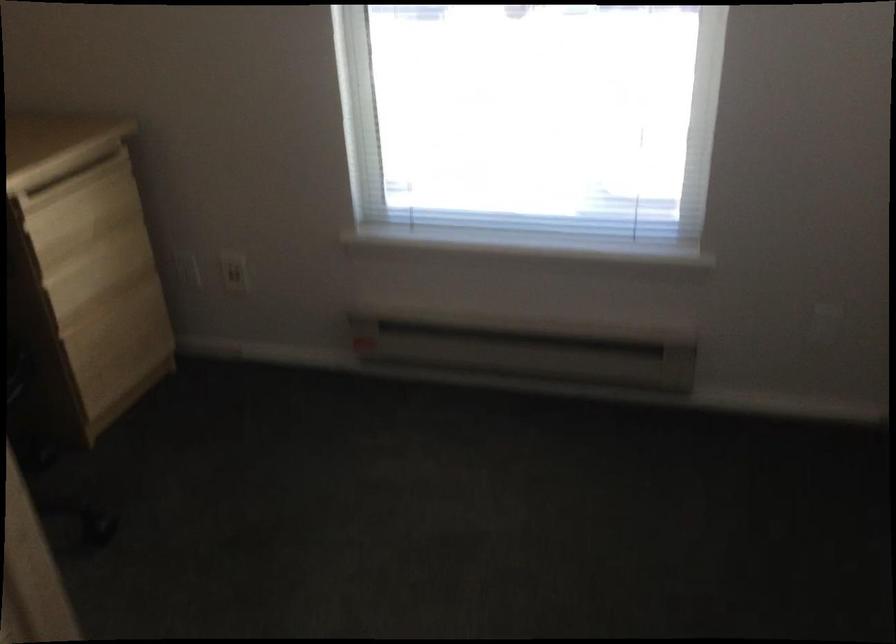
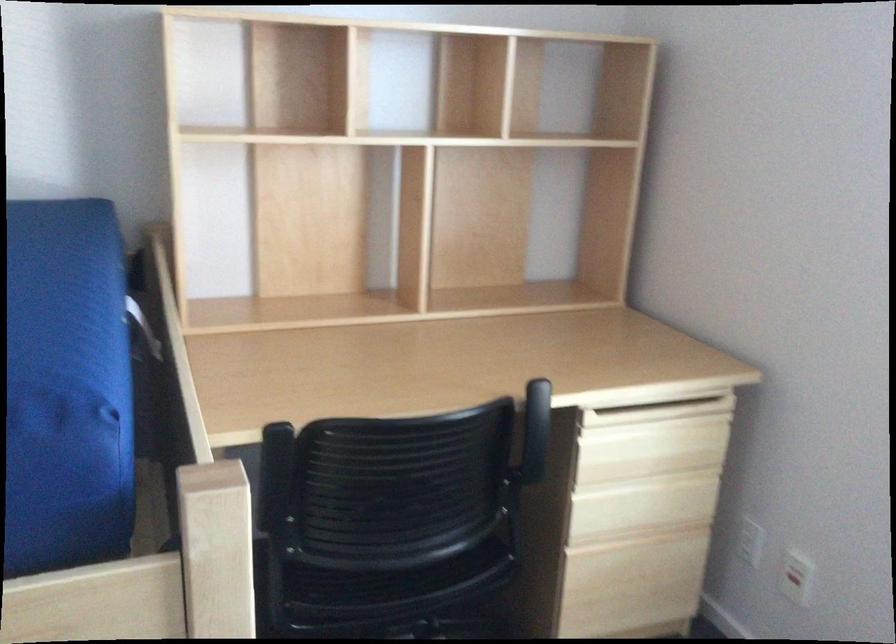
Find the pixel in the second image that matches (x=84, y=218) in the first image.

(650, 448)